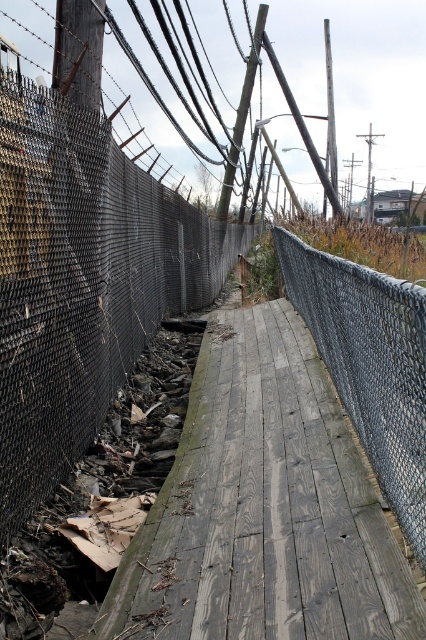
Question: Is rusty metal fence at left positioned before chain-link fence at center?

Choices:
 (A) no
 (B) yes

Answer: (B)

Question: Considering the relative positions of rusty metal fence at left and chain-link fence at center in the image provided, where is rusty metal fence at left located with respect to chain-link fence at center?

Choices:
 (A) right
 (B) left

Answer: (B)

Question: Does rusty metal fence at left appear over chain-link fence at center?

Choices:
 (A) no
 (B) yes

Answer: (B)

Question: Which object is closer to the camera taking this photo?

Choices:
 (A) chain-link fence at center
 (B) rusty metal fence at left

Answer: (B)